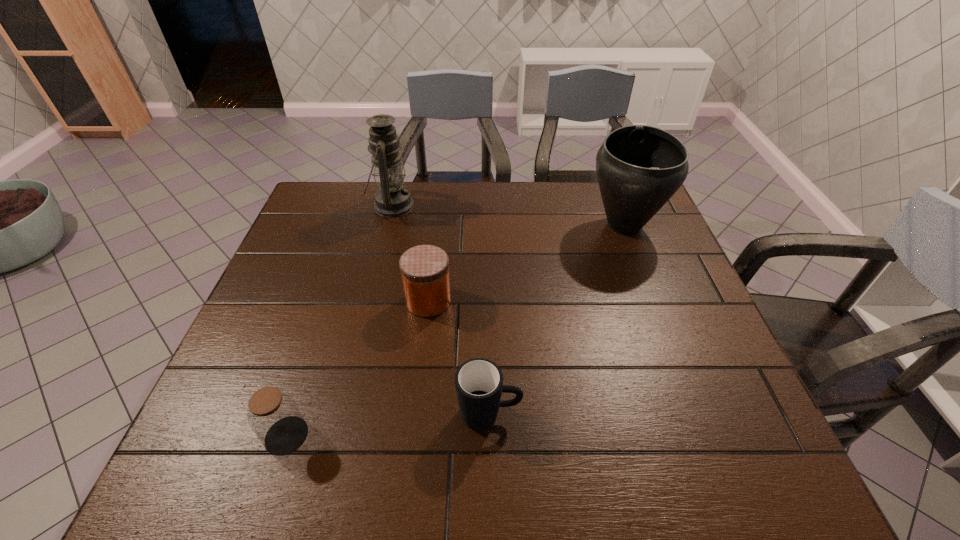
Identify the location of free space between the right jar and the rightmost object. (526, 263).

I want to click on free spot between the second object from right to left and the urn, so click(557, 320).

Select which object appears as the closest to the farther jar. Please provide its 2D coordinates. Your answer should be formatted as a tuple, i.e. [(x, y)], where the tuple contains the x and y coordinates of a point satisfying the conditions above.

[(479, 385)]

Identify which object is the third closest to the oil lamp. Please provide its 2D coordinates. Your answer should be formatted as a tuple, i.e. [(x, y)], where the tuple contains the x and y coordinates of a point satisfying the conditions above.

[(479, 385)]

The height and width of the screenshot is (540, 960). In order to click on free space in the image that satisfies the following two spatial constraints: 1. on the back side of the nearer jar; 2. on the right side of the oil lamp in this screenshot , I will do `click(363, 206)`.

You are a GUI agent. You are given a task and a screenshot of the screen. Output one action in this format:
    pyautogui.click(x=<x>, y=<y>)
    Task: Click on the vacant space that satisfies the following two spatial constraints: 1. on the back side of the oil lamp; 2. on the right side of the nearer jar
    
    Given the screenshot: What is the action you would take?
    click(x=363, y=206)